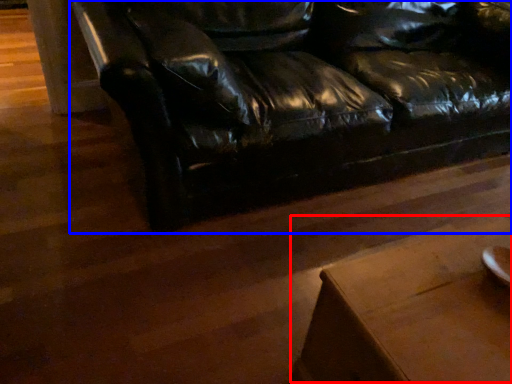
Question: Which of the following is the closest to the observer, table (highlighted by a red box) or studio couch (highlighted by a blue box)?

Choices:
 (A) table
 (B) studio couch

Answer: (A)